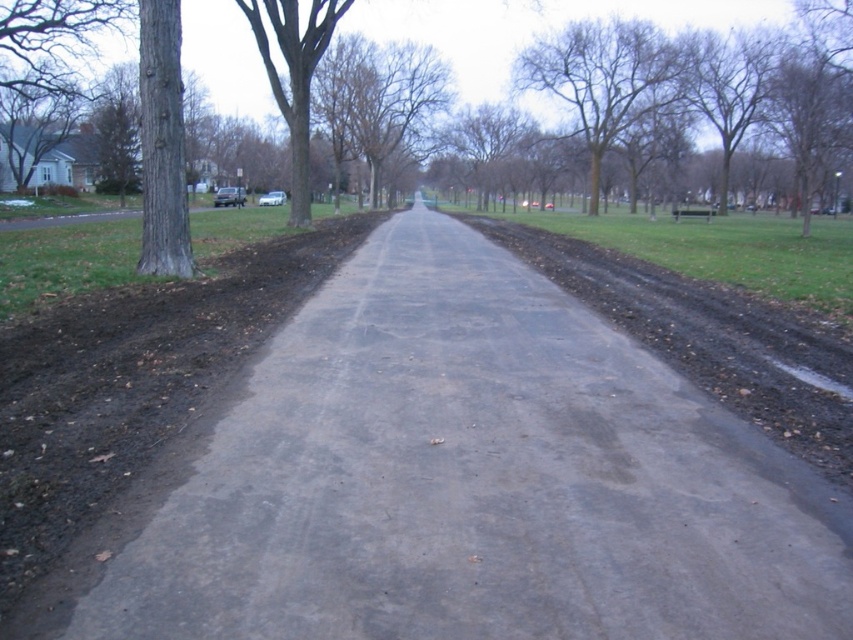
You are a pedestrian carrying a large box that is taller than you. You see the gray asphalt path at center and the brown rough tree at left. Which object is shorter, allowing you to pass under it with your box?

The gray asphalt path at center is shorter than the brown rough tree at left, so you can pass under the gray asphalt path at center with your box.